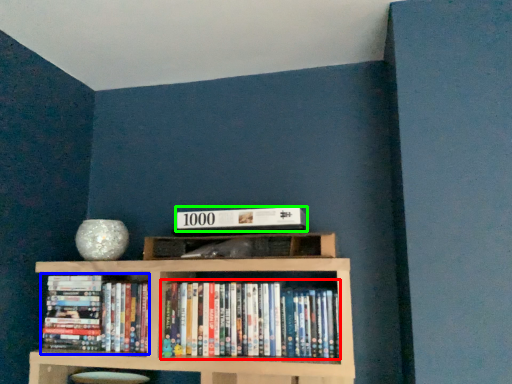
Question: Which is nearer to the book (highlighted by a red box)? book (highlighted by a blue box) or paperback book (highlighted by a green box).

Choices:
 (A) book
 (B) paperback book

Answer: (B)